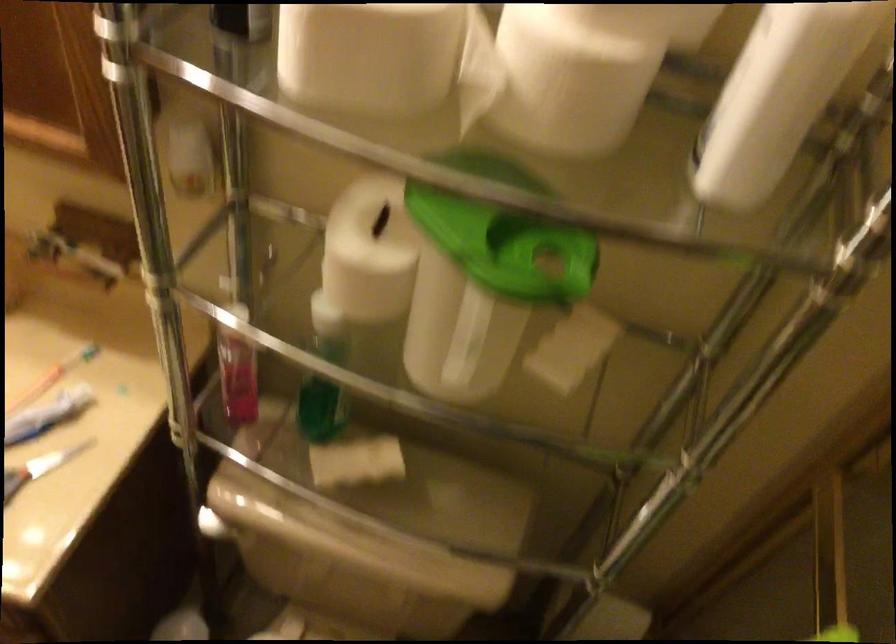
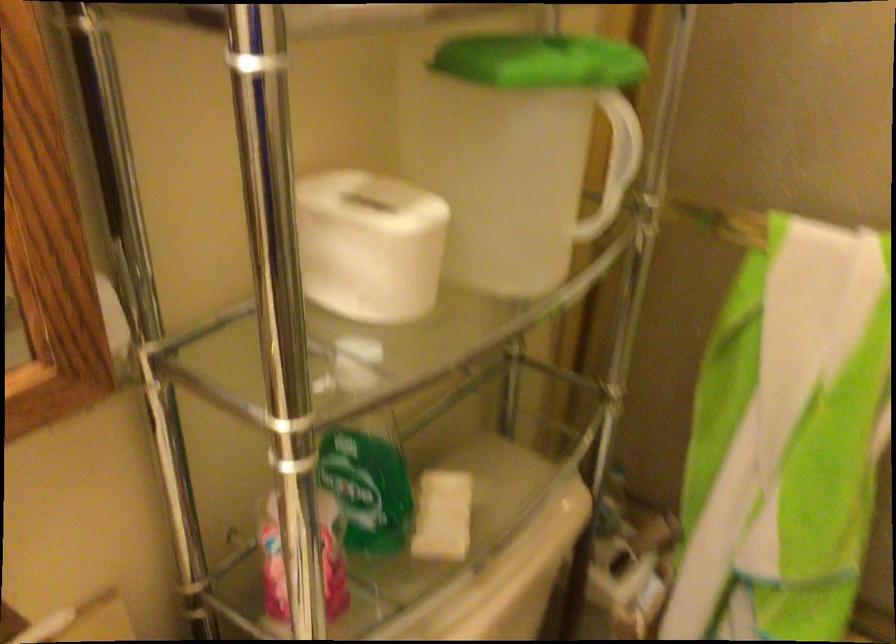
Where in the second image is the point corresponding to [468,339] from the first image?

(618, 152)